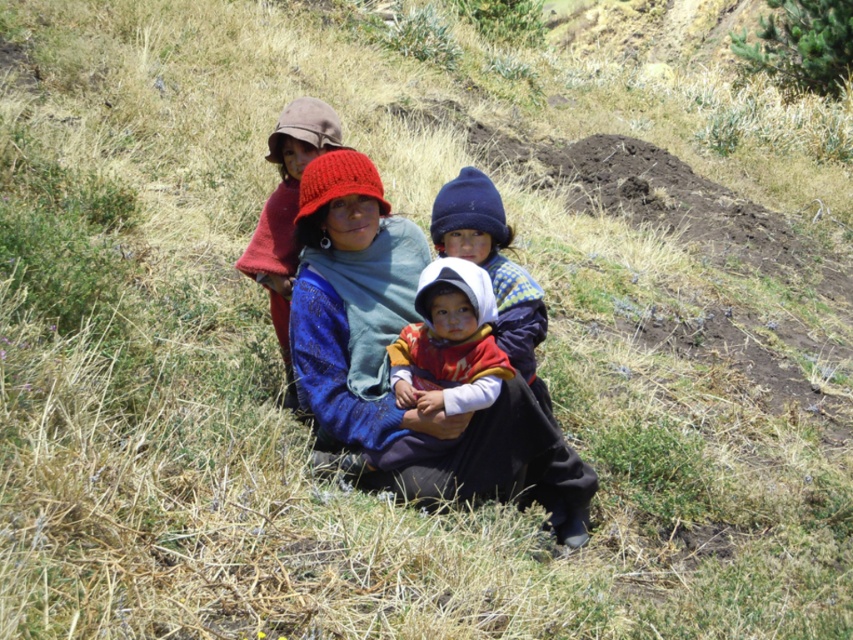
Question: Can you confirm if multicolored woven cloth at center is positioned to the right of knitted wool hat at center?

Choices:
 (A) yes
 (B) no

Answer: (A)

Question: Which of the following is the closest to the observer?

Choices:
 (A) (440, 387)
 (B) (282, 128)

Answer: (A)

Question: Does multicolored woven cloth at center have a greater width compared to knitted wool hat at center?

Choices:
 (A) no
 (B) yes

Answer: (B)

Question: In this image, where is multicolored woven cloth at center located relative to knitted wool hat at center?

Choices:
 (A) left
 (B) right

Answer: (B)

Question: Which of the following is the farthest from the observer?

Choices:
 (A) multicolored woven cloth at center
 (B) knitted wool hat at center

Answer: (B)

Question: Which point is farther to the camera?

Choices:
 (A) knitted wool hat at center
 (B) multicolored woven cloth at center

Answer: (A)